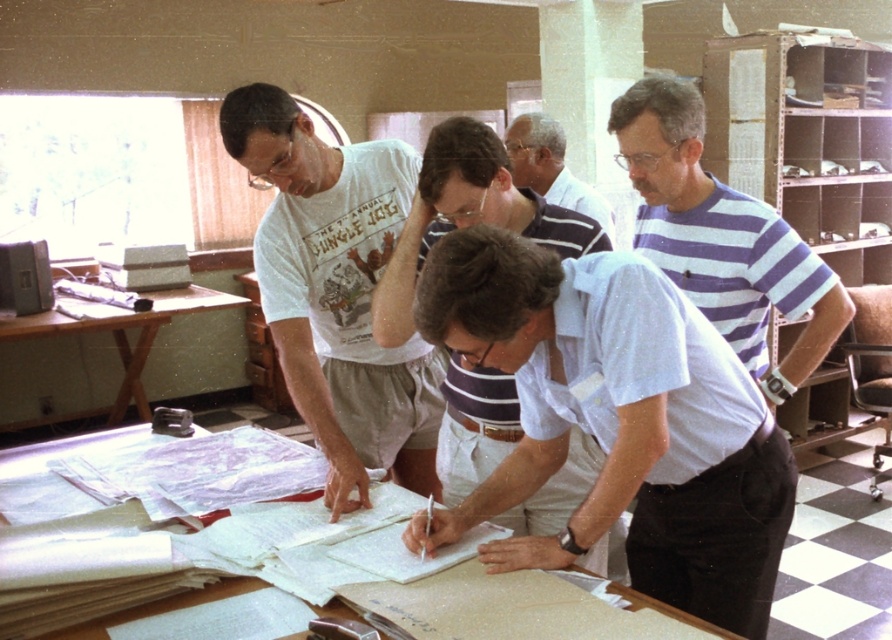
You are a new intern who just entered the office and need to place a coffee mug on the table. However, you want to avoid spilling coffee on the white paper at center. Where should you place the mug on the brown wooden table at left to keep it away from the paper?

The white paper at center is in front of the brown wooden table at left, so placing the mug behind the white paper at center on the brown wooden table at left would keep it away from the paper.

Looking at this image, you are a delivery robot in the office. You need to deliver a package to the point marked at coordinates point (131, 612). The robot has a maximum reach of 1.5 meters. Can you deliver the package without moving closer than 1 meter to the group of people around the table?

The distance between point (131, 612) and the camera is 1.45 meters. Since the robot can reach up to 1.5 meters, it can deliver the package. Additionally, the robot must ensure it stays at least 1 meter away from the group. The current distance of 1.45 meters is within the safe range, so the delivery is possible without moving closer than required.

Based on the photo, you are an office assistant who needs to place a new document on the table. The document is as wide as the white striped shirt at upper center. Will it fit on the white paper at center without overlapping the edges?

The white paper at center is wider than the white striped shirt at upper center, so the new document will fit on the white paper at center without overlapping the edges.